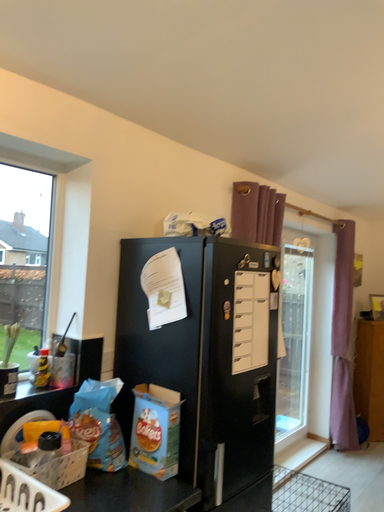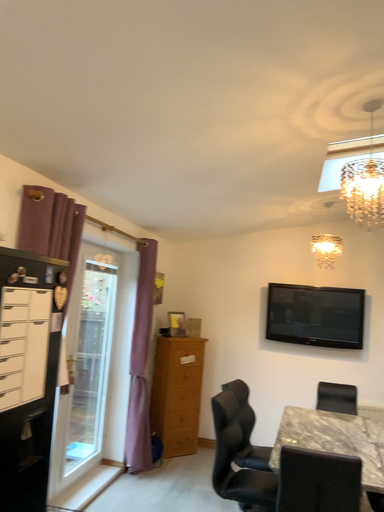
Question: Which way did the camera rotate in the video?

Choices:
 (A) rotated right
 (B) rotated left

Answer: (A)